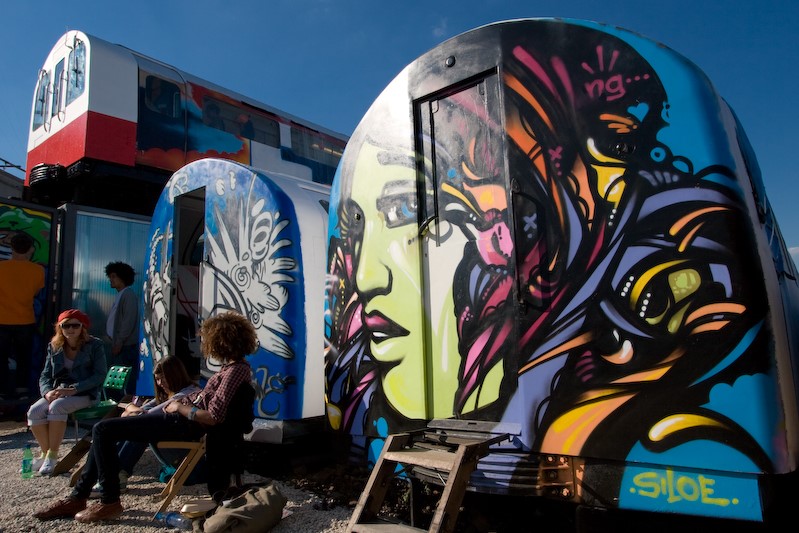
In order to click on bottle in this screenshot , I will do `click(26, 467)`.